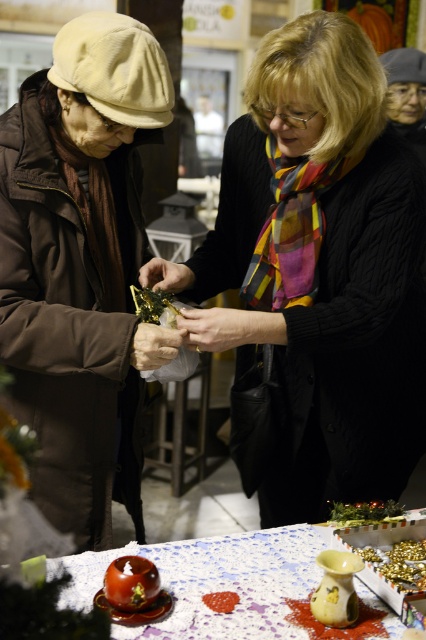
You are a customer at a craft fair and see both the matte gold ornament at center and the green leafy vegetable at center. Which item is located to the left of the other?

The matte gold ornament at center is positioned on the left side of green leafy vegetable at center.

You are standing at the center of the scene. Which object from the list is positioned to your left? The options are the matte brown coat at left and another object not shown here.

The matte brown coat at left is located at point (x=80, y=264), which would be to your left if you are at the center of the scene.

You are organizing a food display for a charity event and have the shiny brown tomato at lower left and the green leafy vegetable at center. Which item should you place in a smaller container to save space?

The shiny brown tomato at lower left should be placed in a smaller container because it occupies less space than the green leafy vegetable at center.